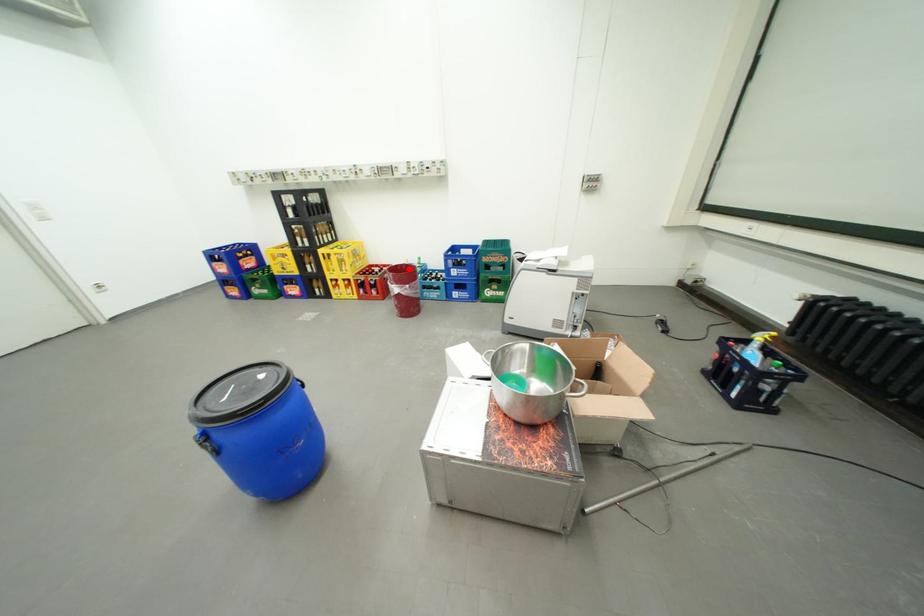
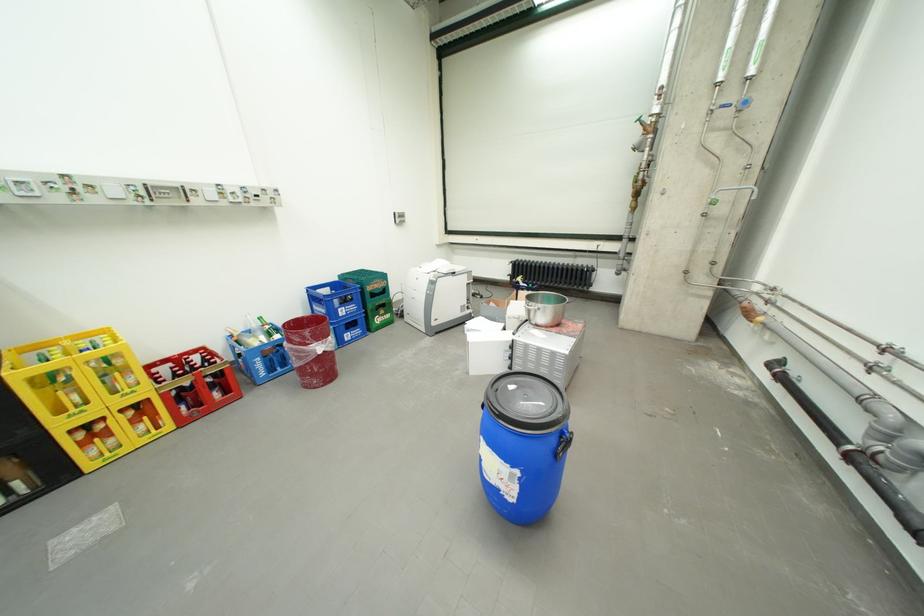
Question: I am providing you with two images of the same scene from different viewpoints. Given a red point in image1, look at the same physical point in image2. Is it:

Choices:
 (A) Closer to the viewpoint
 (B) Farther from the viewpoint

Answer: (B)